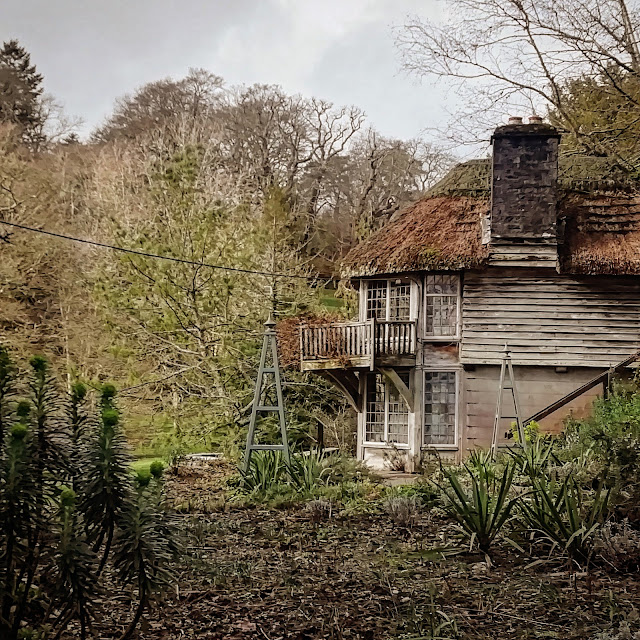
You are a GUI agent. You are given a task and a screenshot of the screen. Output one action in this format:
    pyautogui.click(x=<x>, y=<y>)
    Task: Click on the window
    This screenshot has width=640, height=640.
    Given the screenshot: What is the action you would take?
    pyautogui.click(x=441, y=317), pyautogui.click(x=397, y=304), pyautogui.click(x=374, y=304), pyautogui.click(x=374, y=417), pyautogui.click(x=397, y=417), pyautogui.click(x=438, y=415)